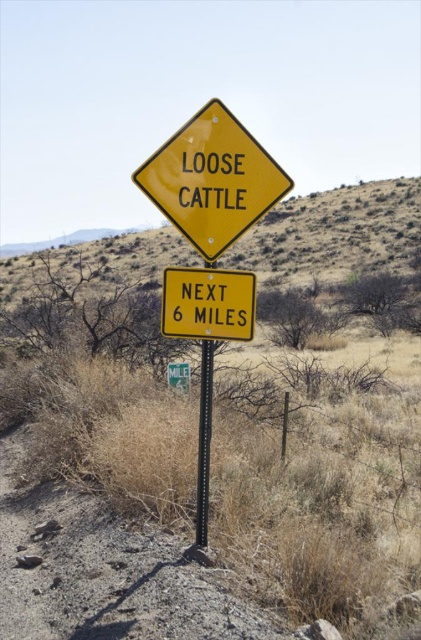
You are a driver approaching the roadside warning sign. You notice two yellow signs at the center. Which one is nearer to you, the yellow plastic sign at center or the yellow matte sign at center?

The yellow plastic sign at center is closer to the viewer than the yellow matte sign at center.